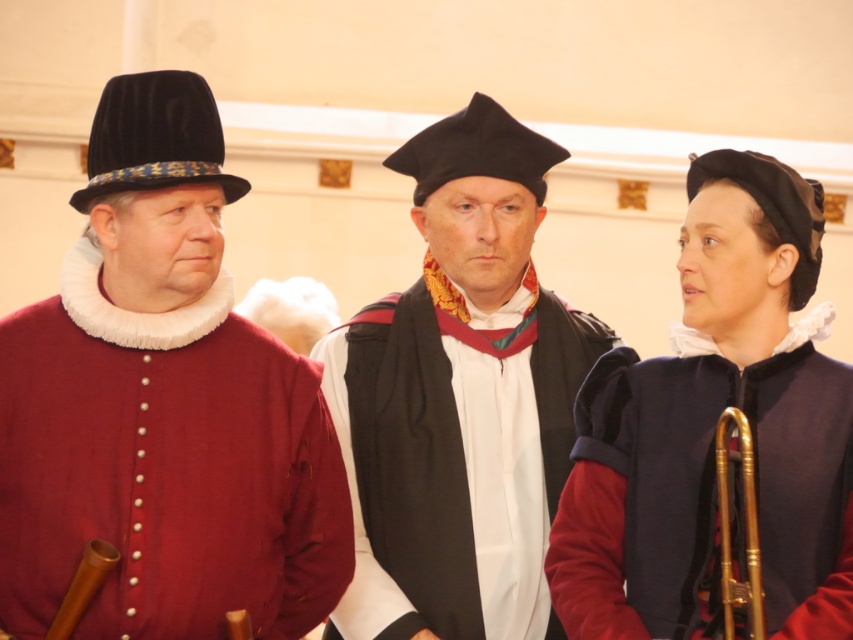
Question: From the image, what is the correct spatial relationship of matte red coat at left in relation to gold brass trumpet at lower right?

Choices:
 (A) right
 (B) left

Answer: (B)

Question: Which object is closer to the camera taking this photo?

Choices:
 (A) gold brass trumpet at lower right
 (B) wooden flute at left
 (C) matte black gown at center
 (D) matte red coat at left

Answer: (B)

Question: Which object is positioned closest to the matte red coat at left?

Choices:
 (A) matte black gown at center
 (B) gold brass trumpet at lower right

Answer: (A)

Question: Does matte black gown at center appear on the left side of gold brass trumpet at lower right?

Choices:
 (A) no
 (B) yes

Answer: (B)

Question: Does matte red coat at left have a smaller size compared to velvet black beret at right?

Choices:
 (A) no
 (B) yes

Answer: (B)

Question: Considering the real-world distances, which object is closest to the matte red coat at left?

Choices:
 (A) velvet black beret at right
 (B) matte black gown at center
 (C) wooden flute at left

Answer: (C)